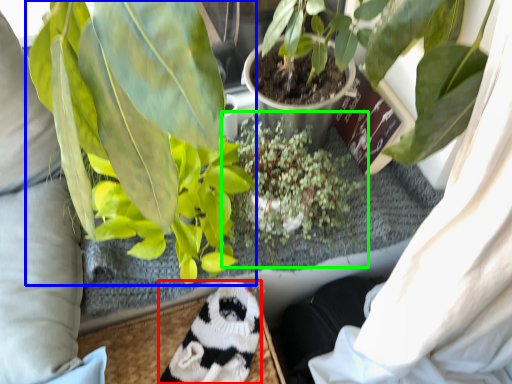
Question: Which object is the farthest from animal (highlighted by a red box)? Choose among these: houseplant (highlighted by a blue box) or houseplant (highlighted by a green box).

Choices:
 (A) houseplant
 (B) houseplant

Answer: (A)